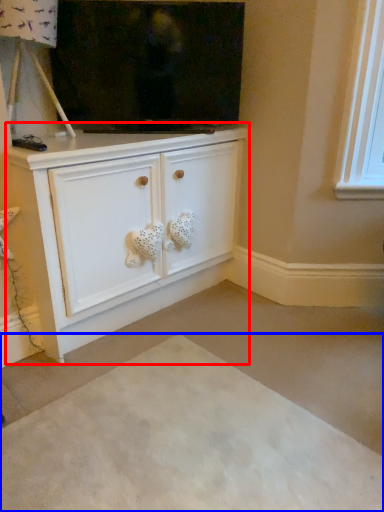
Question: Which of the following is the farthest to the observer, cabinetry (highlighted by a red box) or plain (highlighted by a blue box)?

Choices:
 (A) cabinetry
 (B) plain

Answer: (A)